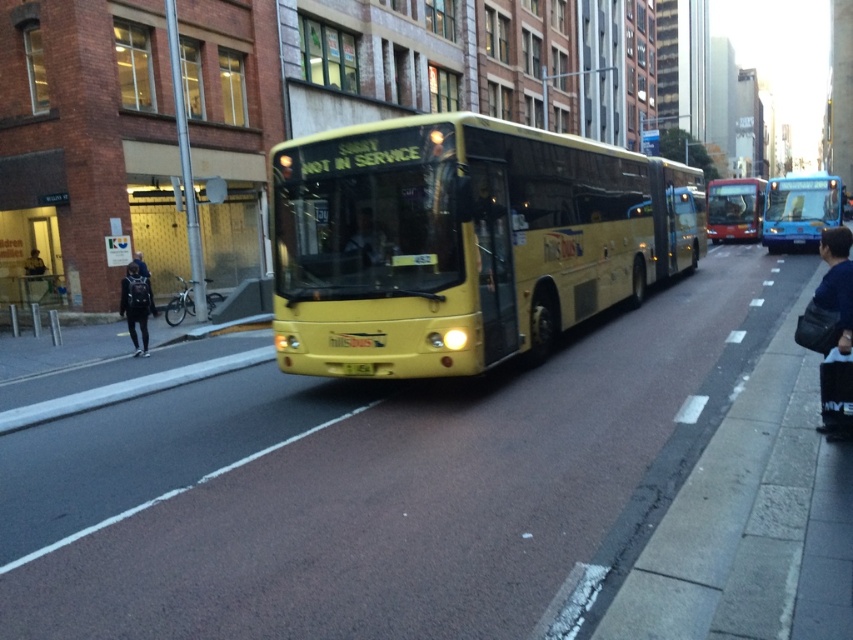
You are a pedestrian standing on the sidewalk and see the dark blue fabric jacket at left and the matte black bus at center. Which object is larger in the image?

The dark blue fabric jacket at left is bigger than the matte black bus at center in the image.

You are a pedestrian standing at the crosswalk near the yellow bus. You see a denim jacket at lower right and a dark blue fabric jacket at left. Which jacket is closer to you?

The denim jacket at lower right is closer to you because it is in front of the dark blue fabric jacket at left.